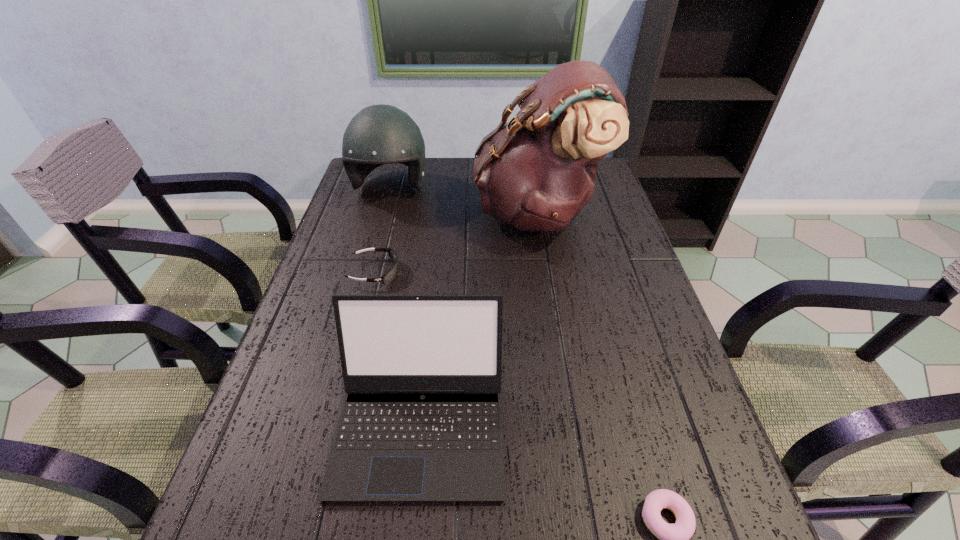
Locate an element on the screen. The width and height of the screenshot is (960, 540). satchel that is at the far edge is located at coordinates (536, 173).

Find the location of `football helmet situated at the far edge`. football helmet situated at the far edge is located at coordinates (380, 134).

Where is `football helmet at the left edge`? This screenshot has height=540, width=960. football helmet at the left edge is located at coordinates (380, 134).

Image resolution: width=960 pixels, height=540 pixels. I want to click on laptop located in the left edge section of the desktop, so click(421, 420).

This screenshot has width=960, height=540. In order to click on goggles that is positioned at the left edge in this screenshot , I will do `click(392, 272)`.

Find the location of a particular element. Image resolution: width=960 pixels, height=540 pixels. object present at the right edge is located at coordinates (536, 173).

This screenshot has width=960, height=540. Identify the location of object that is at the far left corner. click(380, 134).

Identify the location of object located at the far right corner. The image size is (960, 540). (536, 173).

Where is `vacant space at the far edge of the desktop`? This screenshot has width=960, height=540. vacant space at the far edge of the desktop is located at coordinates (471, 181).

Image resolution: width=960 pixels, height=540 pixels. In the image, there is a desktop. Find the location of `vacant area at the near edge`. vacant area at the near edge is located at coordinates (481, 538).